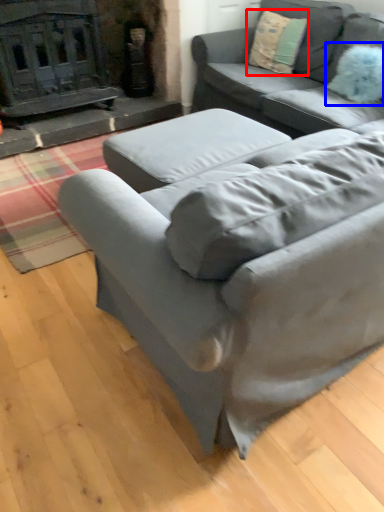
Question: Which object appears closest to the camera in this image, throw pillow (highlighted by a red box) or pillow (highlighted by a blue box)?

Choices:
 (A) throw pillow
 (B) pillow

Answer: (B)